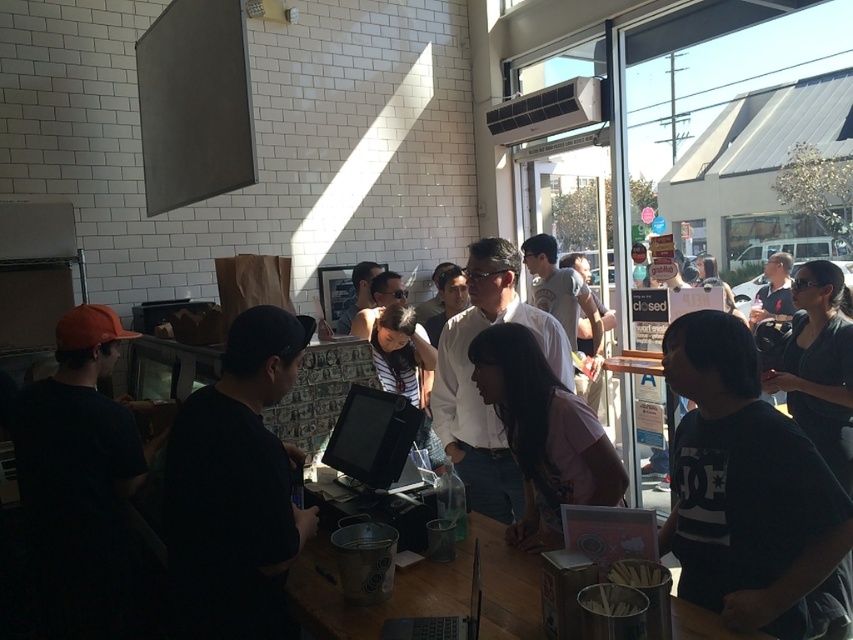
Is black cotton t-shirt at right positioned behind pink fabric shirt at center?

That is False.

Does black cotton t-shirt at right have a lesser width compared to pink fabric shirt at center?

In fact, black cotton t-shirt at right might be wider than pink fabric shirt at center.

Locate an element on the screen. black cotton t-shirt at right is located at coordinates (747, 492).

Which is below, black cotton t-shirt at right or wooden table at center?

wooden table at center is below.

Who is more distant from viewer, [746,589] or [715,634]?

Point [746,589]

The image size is (853, 640). What are the coordinates of `black cotton t-shirt at right` in the screenshot? It's located at (747, 492).

Can you confirm if pink fabric shirt at center is taller than wooden table at center?

Indeed, pink fabric shirt at center has a greater height compared to wooden table at center.

Which is behind, point (515, 348) or point (494, 593)?

The point (515, 348) is behind.

This screenshot has width=853, height=640. Find the location of `pink fabric shirt at center`. pink fabric shirt at center is located at coordinates (543, 435).